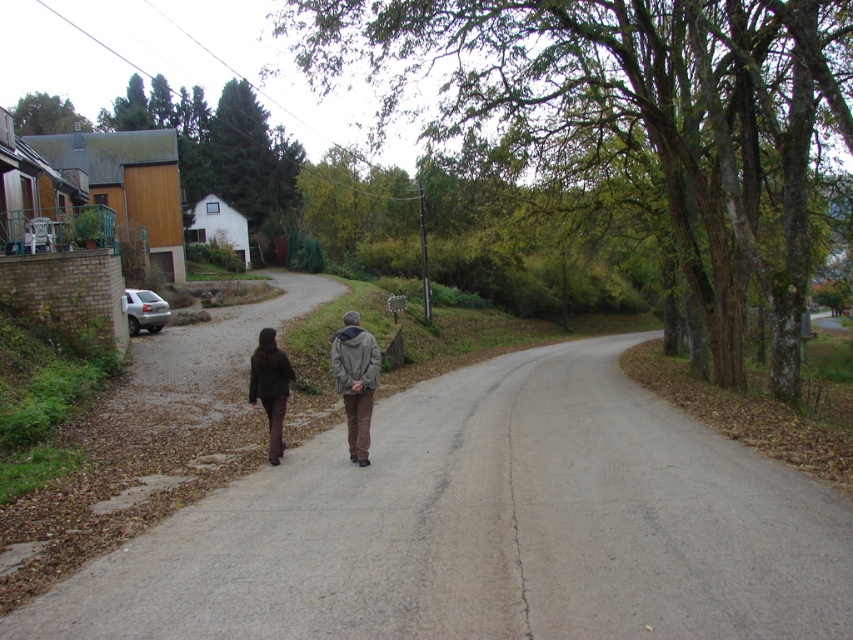
At what (x,y) coordinates should I click in order to perform the action: click on gray asphalt road at center. Please return your answer as a coordinate pair (x, y). The height and width of the screenshot is (640, 853). Looking at the image, I should click on tap(488, 528).

Does point (512, 416) come in front of point (351, 356)?

No, it is behind (351, 356).

Where is `gray asphalt road at center`? gray asphalt road at center is located at coordinates (488, 528).

The image size is (853, 640). What are the coordinates of `gray woolen jacket at center` in the screenshot? It's located at (355, 380).

Does gray woolen jacket at center have a lesser height compared to dark brown leather jacket at center?

Incorrect, gray woolen jacket at center's height does not fall short of dark brown leather jacket at center's.

What do you see at coordinates (355, 380) in the screenshot? I see `gray woolen jacket at center` at bounding box center [355, 380].

The image size is (853, 640). In order to click on gray woolen jacket at center in this screenshot , I will do `click(355, 380)`.

In the scene shown: Who is more distant from viewer, (x=123, y=612) or (x=352, y=397)?

The point (x=352, y=397) is more distant.

Between gray asphalt road at center and brown leather jacket at center, which one has less height?

gray asphalt road at center

What do you see at coordinates (488, 528) in the screenshot? I see `gray asphalt road at center` at bounding box center [488, 528].

This screenshot has height=640, width=853. In order to click on gray asphalt road at center in this screenshot , I will do `click(488, 528)`.